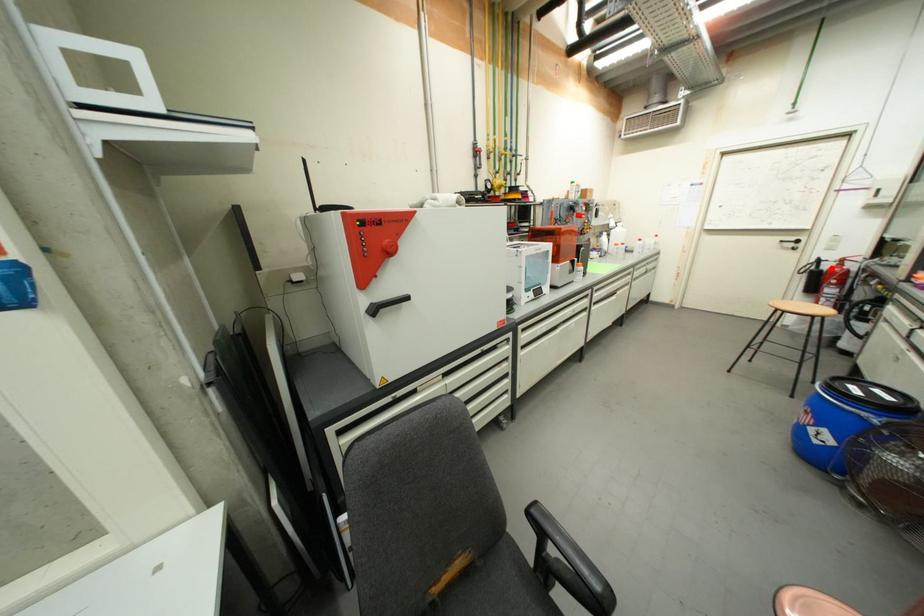
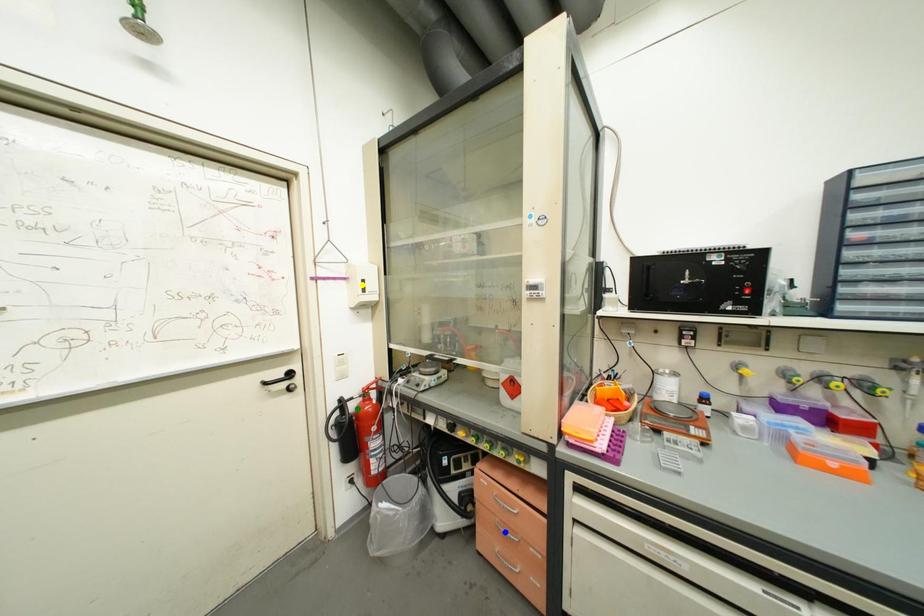
Question: I am providing you with two images of the same scene from different viewpoints. A red point is marked on the first image. You are given multiple points on the second image. Which spot in image 2 lines up with the point in image 1?

Choices:
 (A) green point
 (B) blue point
 (C) yellow point

Answer: (A)